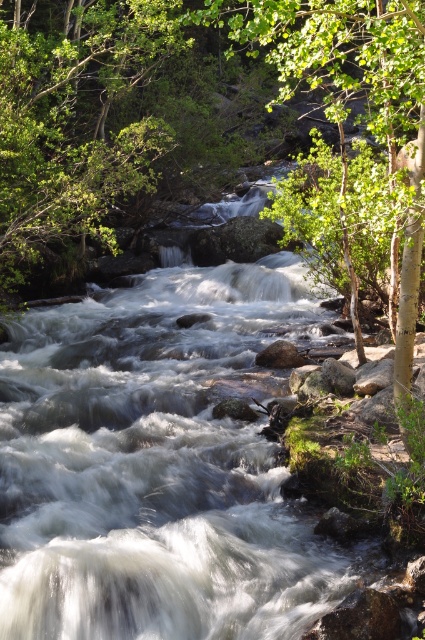
You are standing at the edge of the river and notice two green leafy trees in the scene. According to the image, which tree is positioned lower in the frame, the green leafy tree at upper left or the green leafy tree at center?

The green leafy tree at upper left is located below the green leafy tree at center, so it is positioned lower in the frame.

You are standing at the riverbank and want to walk from the green leafy tree at upper left to the green leafy tree at center. Which direction should you move relative to the river?

You should move away from the river towards the center because the green leafy tree at upper left is closer to you than the green leafy tree at center, which is further away.